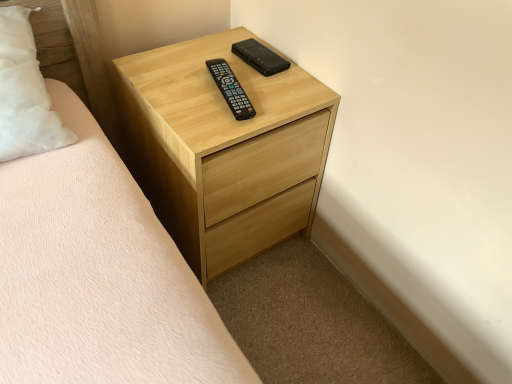
Where is `vacant space behind black plastic remote at center, the first control in the bottom-to-top sequence`? The height and width of the screenshot is (384, 512). vacant space behind black plastic remote at center, the first control in the bottom-to-top sequence is located at coordinates (224, 62).